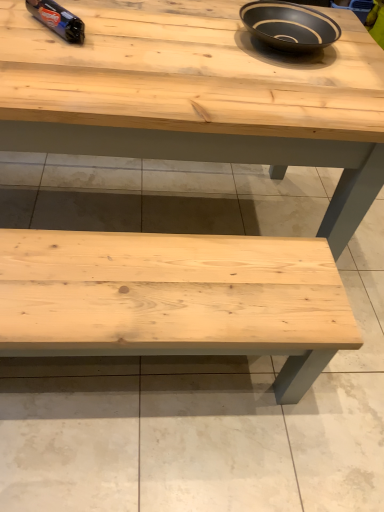
Image resolution: width=384 pixels, height=512 pixels. Find the location of `free area in between black matte bowl at upper center and shiny blue plastic bottle at upper left`. free area in between black matte bowl at upper center and shiny blue plastic bottle at upper left is located at coordinates (162, 34).